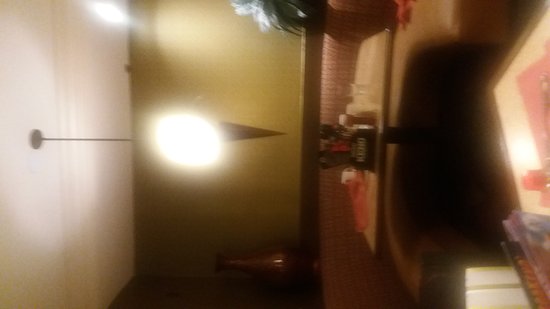
Where is `couch`? This screenshot has width=550, height=309. couch is located at coordinates (335, 75), (349, 276).